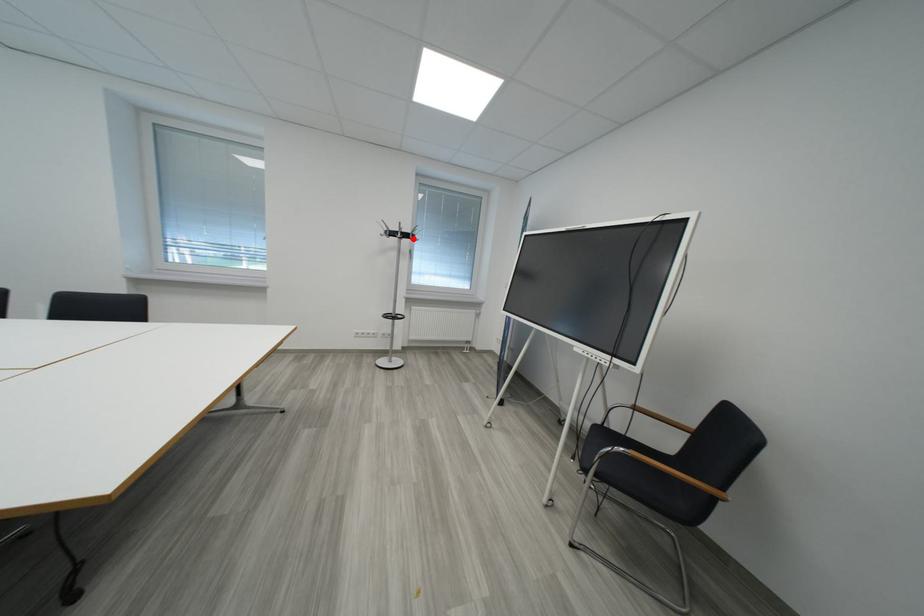
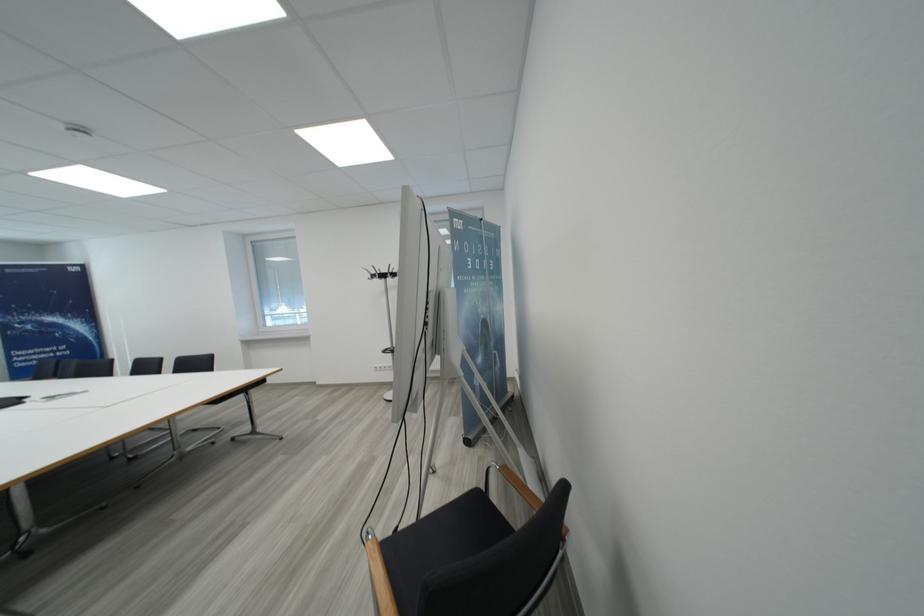
In the second image, find the point that corresponds to the highlighted location in the first image.

(390, 278)